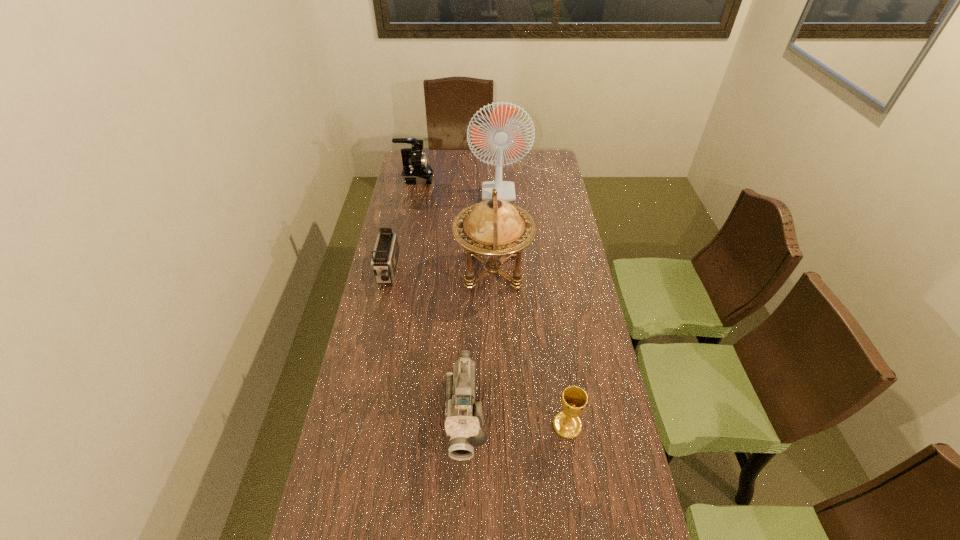
Where is `vacant area at the far edge of the desktop`? The height and width of the screenshot is (540, 960). vacant area at the far edge of the desktop is located at coordinates (504, 154).

This screenshot has width=960, height=540. In order to click on free location at the left edge of the desktop in this screenshot , I will do `click(420, 222)`.

This screenshot has width=960, height=540. Find the location of `vacant point at the right edge`. vacant point at the right edge is located at coordinates (559, 249).

Find the location of a particular element. This screenshot has width=960, height=540. vacant region at the far right corner of the desktop is located at coordinates (560, 172).

The height and width of the screenshot is (540, 960). What are the coordinates of `empty location between the farthest camcorder and the chalice` in the screenshot? It's located at (492, 302).

Find the location of a particular element. vacant space that is in between the farthest camcorder and the chalice is located at coordinates (492, 302).

The image size is (960, 540). In order to click on free spot between the nearest camcorder and the second farthest camcorder in this screenshot , I will do `click(426, 344)`.

Image resolution: width=960 pixels, height=540 pixels. In order to click on free space between the tallest object and the chalice in this screenshot , I will do `click(540, 302)`.

This screenshot has height=540, width=960. What are the coordinates of `vacant area between the second nearest camcorder and the chalice` in the screenshot? It's located at (477, 349).

At what (x,y) coordinates should I click in order to perform the action: click on free space between the second farthest camcorder and the nearest camcorder. Please return your answer as a coordinate pair (x, y). Image resolution: width=960 pixels, height=540 pixels. Looking at the image, I should click on (426, 344).